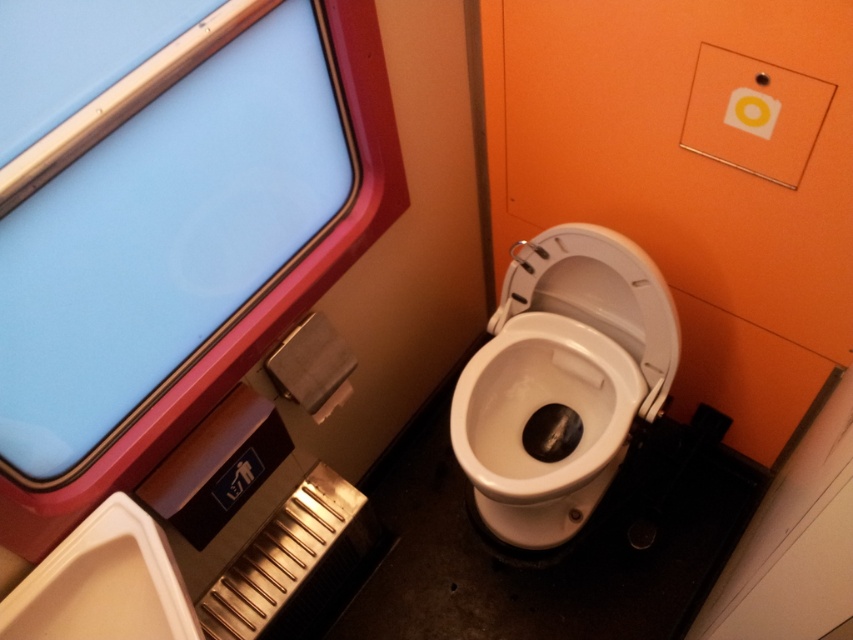
You are a passenger on a train and need to know if you can reach the blue glass window at upper left to open it while sitting on the white glossy toilet bowl at center. Can you reach it?

The blue glass window at upper left is much taller than the white glossy toilet bowl at center, so you cannot reach it while sitting on the toilet.

You are a maintenance worker inspecting the restroom. You need to access both the blue glass window at upper left and the white glossy toilet bowl at center. Which object is easier to reach without moving your position?

The blue glass window at upper left is closer to the viewer than the white glossy toilet bowl at center, so it is easier to reach without moving your position.